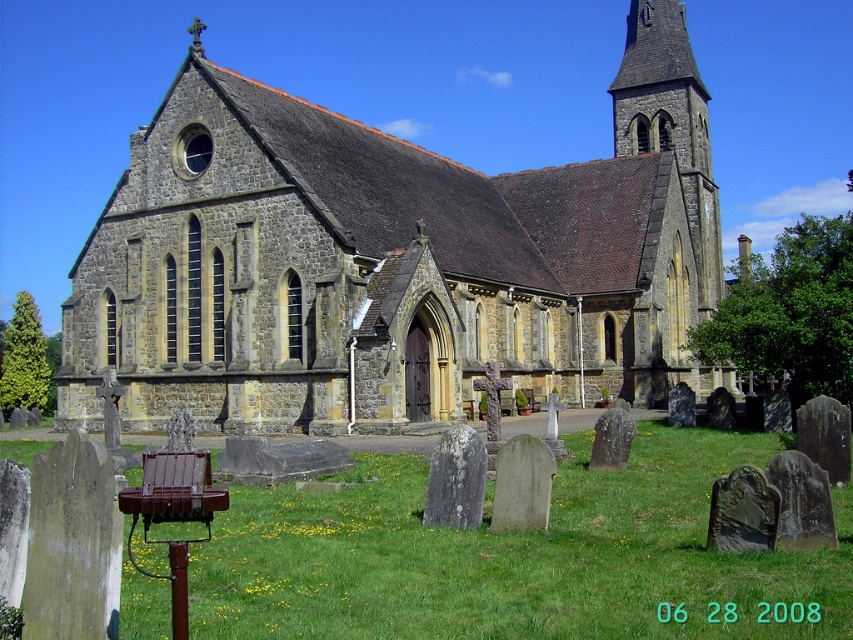
Question: Does stone church at center have a lesser width compared to smooth gray stone gravestone at center?

Choices:
 (A) no
 (B) yes

Answer: (A)

Question: Is gray stone gravestone at center closer to the viewer compared to smooth gray stone gravestone at center?

Choices:
 (A) yes
 (B) no

Answer: (B)

Question: Which point is farther to the camera?

Choices:
 (A) (527, 524)
 (B) (167, 312)
 (C) (453, 497)

Answer: (B)

Question: Does gray stone gravestone at center have a lesser width compared to smooth gray stone gravestone at center?

Choices:
 (A) no
 (B) yes

Answer: (B)

Question: Which object appears farthest from the camera in this image?

Choices:
 (A) smooth gray stone gravestone at center
 (B) gray stone gravestone at center

Answer: (B)

Question: Among these points, which one is nearest to the camera?

Choices:
 (A) (514, 481)
 (B) (480, 516)

Answer: (A)